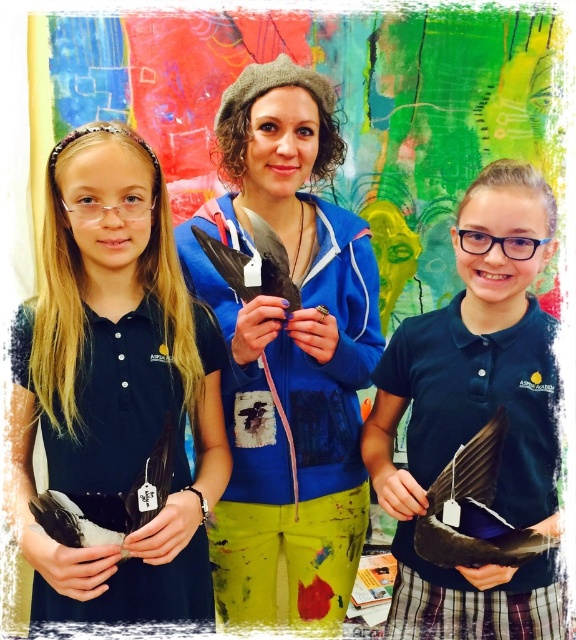
Based on the photo, can you confirm if black matte feather at left is positioned below matte black feather at center?

Yes, black matte feather at left is below matte black feather at center.

Can you confirm if black matte feather at left is bigger than matte black feather at center?

No.

At what (x,y) coordinates should I click in order to perform the action: click on black matte feather at left. Please return your answer as a coordinate pair (x, y). Looking at the image, I should click on (115, 385).

Is black matte feather at left to the left of matte black feather at right from the viewer's perspective?

Yes, black matte feather at left is to the left of matte black feather at right.

What do you see at coordinates (115, 385) in the screenshot? I see `black matte feather at left` at bounding box center [115, 385].

Where is `black matte feather at left`? The image size is (576, 640). black matte feather at left is located at coordinates (115, 385).

Can you confirm if matte black feather at center is smaller than matte black feather at right?

Incorrect, matte black feather at center is not smaller in size than matte black feather at right.

Is point (252, 566) positioned behind point (497, 236)?

Yes, it is behind point (497, 236).

Find the location of a particular element. Image resolution: width=576 pixels, height=640 pixels. matte black feather at center is located at coordinates (289, 353).